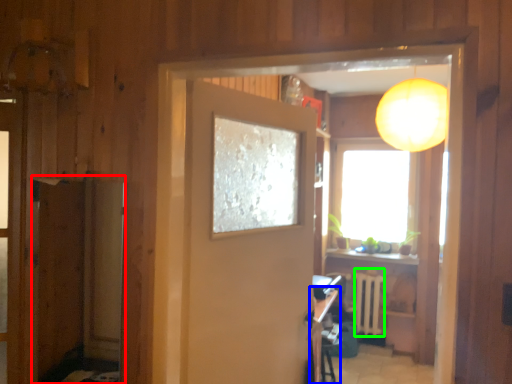
Question: Which is farther away from screen door (highlighted by a red box)? table (highlighted by a blue box) or radiator (highlighted by a green box)?

Choices:
 (A) table
 (B) radiator

Answer: (B)